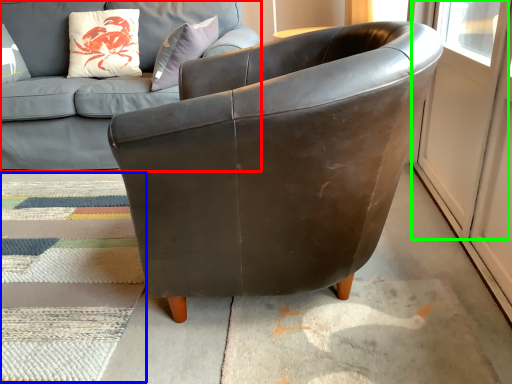
Question: Which object is positioned closest to studio couch (highlighted by a red box)? Select from mat (highlighted by a blue box) and screen door (highlighted by a green box).

Choices:
 (A) mat
 (B) screen door

Answer: (A)